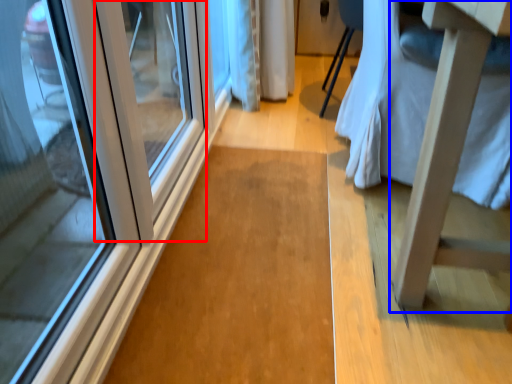
Question: Which point is closer to the camera, door (highlighted by a red box) or changing table (highlighted by a blue box)?

Choices:
 (A) door
 (B) changing table

Answer: (B)